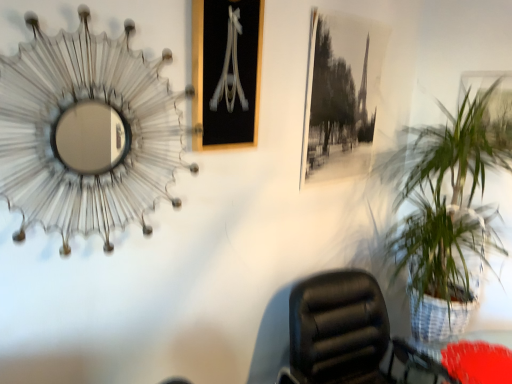
Question: From the image's perspective, would you say black leather chair at lower right is positioned over metallic silver picture frame at upper right, marked as the third picture frame in a left-to-right arrangement?

Choices:
 (A) no
 (B) yes

Answer: (A)

Question: Can you confirm if black leather chair at lower right is wider than metallic silver picture frame at upper right, positioned as the 1th picture frame in right-to-left order?

Choices:
 (A) no
 (B) yes

Answer: (B)

Question: Would you say black leather chair at lower right contains metallic silver picture frame at upper right, marked as the third picture frame in a left-to-right arrangement?

Choices:
 (A) no
 (B) yes

Answer: (A)

Question: Does black leather chair at lower right appear on the right side of metallic silver picture frame at upper right, marked as the third picture frame in a left-to-right arrangement?

Choices:
 (A) yes
 (B) no

Answer: (B)

Question: Is black leather chair at lower right oriented towards metallic silver picture frame at upper right, positioned as the 1th picture frame in right-to-left order?

Choices:
 (A) no
 (B) yes

Answer: (A)

Question: From a real-world perspective, is black leather chair at lower right physically located above or below green leafy plant in woven basket at right?

Choices:
 (A) below
 (B) above

Answer: (A)

Question: Is black leather chair at lower right wider or thinner than green leafy plant in woven basket at right?

Choices:
 (A) wide
 (B) thin

Answer: (B)

Question: From the image's perspective, is black leather chair at lower right located above or below green leafy plant in woven basket at right?

Choices:
 (A) above
 (B) below

Answer: (B)

Question: Considering the positions of black leather chair at lower right and green leafy plant in woven basket at right in the image, is black leather chair at lower right taller or shorter than green leafy plant in woven basket at right?

Choices:
 (A) short
 (B) tall

Answer: (A)

Question: Is green leafy plant in woven basket at right to the left or to the right of black glass picture frame at upper center, which ranks as the third picture frame in right-to-left order, in the image?

Choices:
 (A) right
 (B) left

Answer: (A)

Question: Which is correct: green leafy plant in woven basket at right is inside black glass picture frame at upper center, which ranks as the third picture frame in right-to-left order, or outside of it?

Choices:
 (A) outside
 (B) inside

Answer: (A)

Question: From a real-world perspective, is green leafy plant in woven basket at right above or below black glass picture frame at upper center, the 1th picture frame viewed from the left?

Choices:
 (A) below
 (B) above

Answer: (A)

Question: In terms of size, does green leafy plant in woven basket at right appear bigger or smaller than black glass picture frame at upper center, the 1th picture frame viewed from the left?

Choices:
 (A) small
 (B) big

Answer: (B)

Question: Looking at their shapes, would you say black leather chair at lower right is wider or thinner than metallic silver picture frame at upper right, positioned as the 1th picture frame in right-to-left order?

Choices:
 (A) wide
 (B) thin

Answer: (A)

Question: Considering the positions of black leather chair at lower right and metallic silver picture frame at upper right, positioned as the 1th picture frame in right-to-left order, in the image, is black leather chair at lower right bigger or smaller than metallic silver picture frame at upper right, positioned as the 1th picture frame in right-to-left order,?

Choices:
 (A) small
 (B) big

Answer: (B)